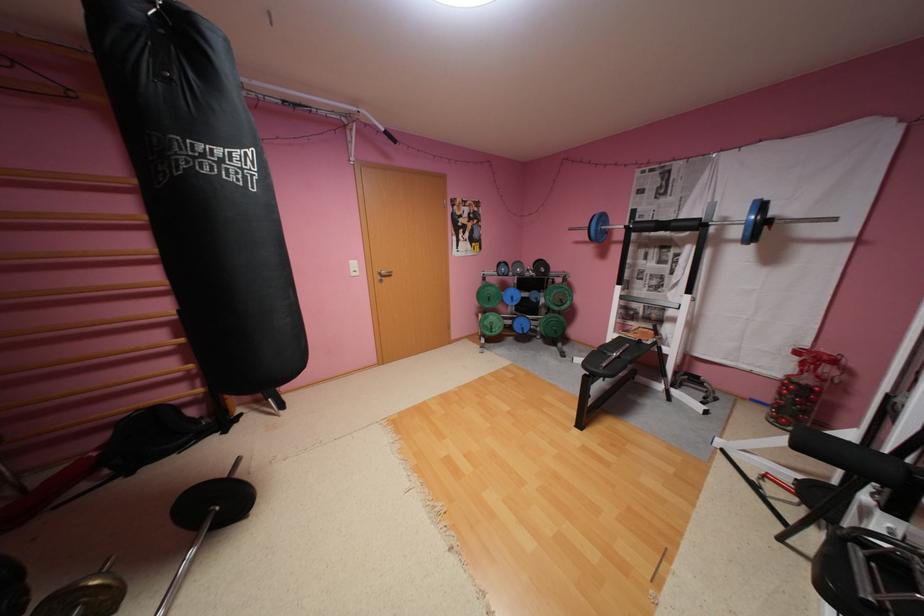
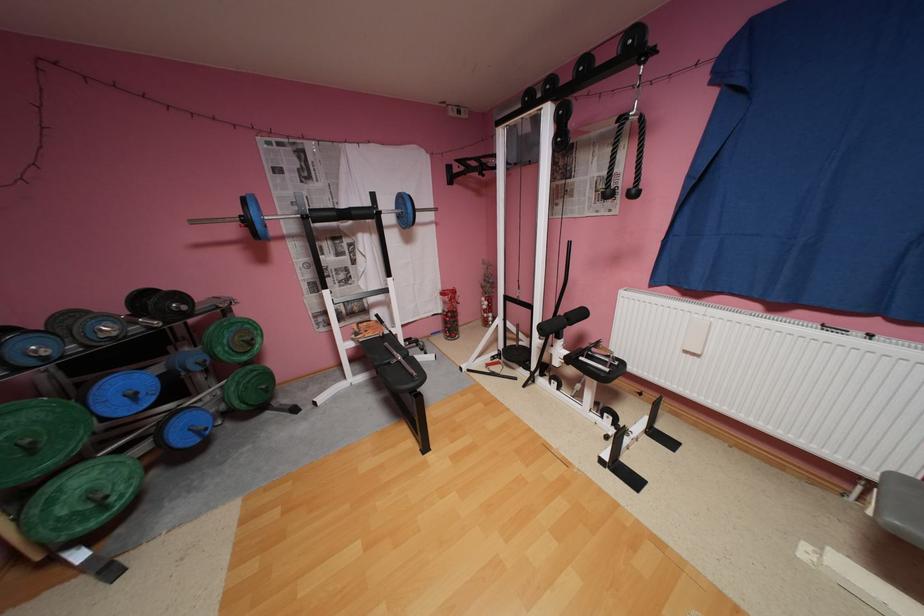
In the second image, find the point that corresponds to pixel 579 229 in the first image.

(202, 223)